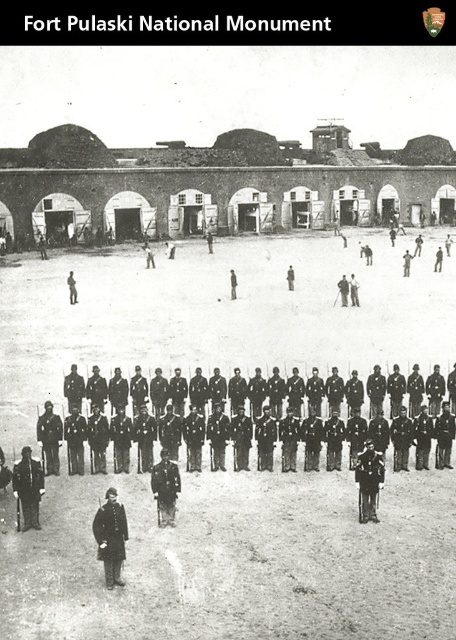
Is dark brown leather coat at center positioned at the back of dark uniform at center?

No, it is in front of dark uniform at center.

Is dark brown leather coat at center positioned before dark uniform at center?

Yes, dark brown leather coat at center is in front of dark uniform at center.

Locate an element on the screen. This screenshot has height=640, width=456. dark brown leather coat at center is located at coordinates (110, 538).